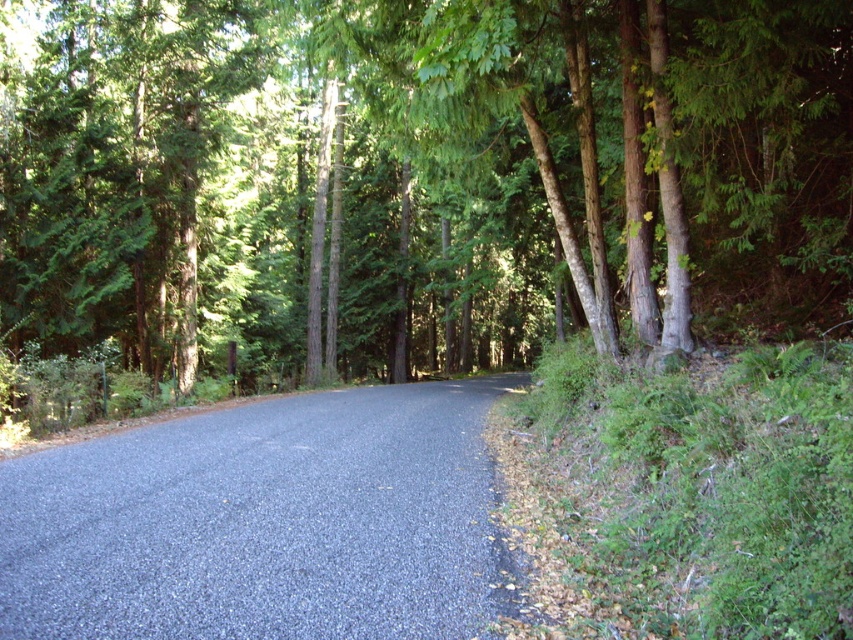
Can you confirm if green leafy tree at center is bigger than gray asphalt road at center?

Correct, green leafy tree at center is larger in size than gray asphalt road at center.

Who is more distant from viewer, (212, 44) or (474, 620)?

The point (212, 44) is behind.

What are the coordinates of `green leafy tree at center` in the screenshot? It's located at (418, 177).